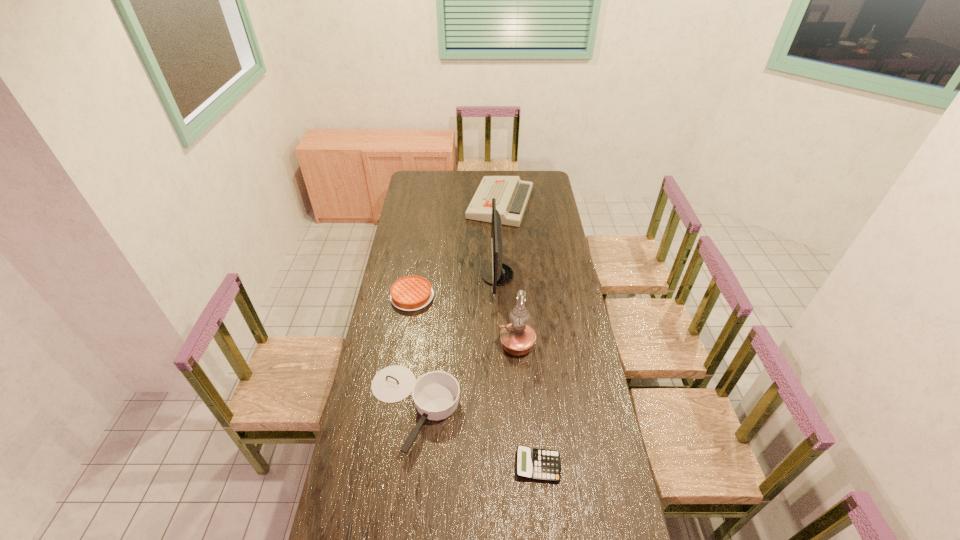
I want to click on monitor, so click(x=496, y=274).

Locate an element on the screen. The height and width of the screenshot is (540, 960). the fourth farthest object is located at coordinates (517, 338).

I want to click on the farthest object, so click(512, 194).

Image resolution: width=960 pixels, height=540 pixels. In order to click on saucepan in this screenshot , I will do `click(436, 394)`.

At what (x,y) coordinates should I click in order to perform the action: click on the third shortest object. Please return your answer as a coordinate pair (x, y). This screenshot has height=540, width=960. Looking at the image, I should click on (x=410, y=293).

Locate an element on the screen. calculator is located at coordinates pos(536,464).

Locate an element on the screen. This screenshot has height=540, width=960. vacant space situated 0.150m on the screen side of the monitor is located at coordinates (451, 275).

Where is `free space located 0.340m on the screen side of the monitor`? Image resolution: width=960 pixels, height=540 pixels. free space located 0.340m on the screen side of the monitor is located at coordinates (413, 275).

Find the location of a particular element. free location located on the screen side of the monitor is located at coordinates (429, 275).

You are a GUI agent. You are given a task and a screenshot of the screen. Output one action in this format:
    pyautogui.click(x=<x>, y=<y>)
    Task: Click on the free space located on the left of the oil lamp
    
    Given the screenshot: What is the action you would take?
    pyautogui.click(x=426, y=345)